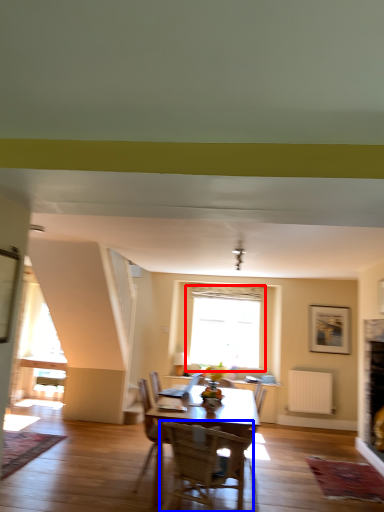
Question: Which point is further to the camera, window (highlighted by a red box) or chair (highlighted by a blue box)?

Choices:
 (A) window
 (B) chair

Answer: (A)